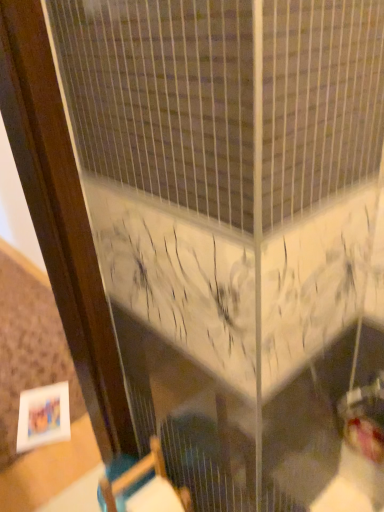
Question: Which is correct: white matte picture frame at lower left is inside wooden chair at lower center, or outside of it?

Choices:
 (A) outside
 (B) inside

Answer: (A)

Question: From the image's perspective, relative to wooden chair at lower center, is white matte picture frame at lower left above or below?

Choices:
 (A) above
 (B) below

Answer: (B)

Question: Based on their positions, is white matte picture frame at lower left located to the left or right of wooden chair at lower center?

Choices:
 (A) right
 (B) left

Answer: (B)

Question: Does point (122, 508) appear closer or farther from the camera than point (59, 418)?

Choices:
 (A) farther
 (B) closer

Answer: (B)

Question: In terms of height, does wooden chair at lower center look taller or shorter compared to white matte picture frame at lower left?

Choices:
 (A) short
 (B) tall

Answer: (B)

Question: Would you say wooden chair at lower center is inside or outside white matte picture frame at lower left?

Choices:
 (A) outside
 (B) inside

Answer: (A)

Question: Relative to white matte picture frame at lower left, is wooden chair at lower center in front or behind?

Choices:
 (A) front
 (B) behind

Answer: (A)